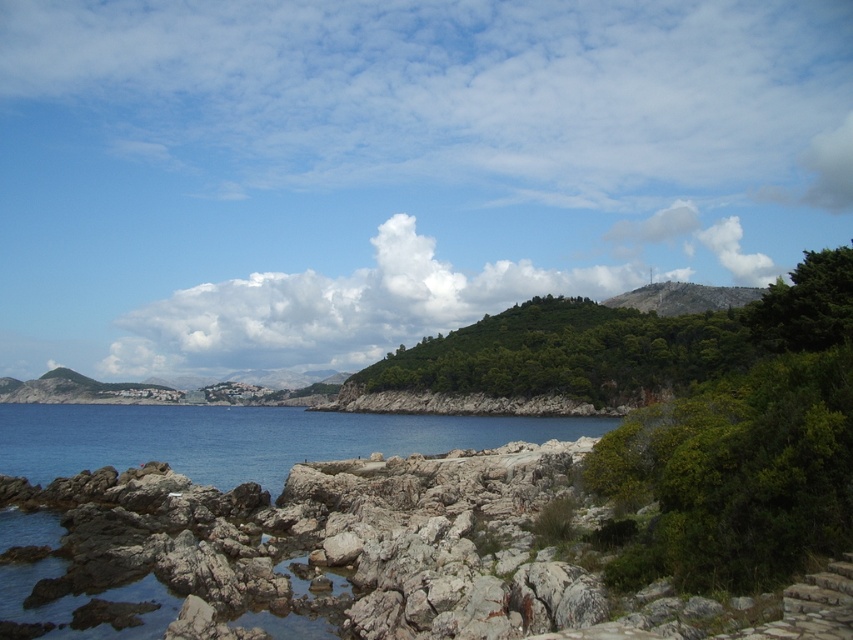
You are a hiker planning to cross the green leafy hill at center and the blue water at lower left. Which terrain would be easier to traverse?

The blue water at lower left is easier to traverse because it has a larger size than the green leafy hill at center.

Based on the coordinates provided, what is the position of the white fluffy cloud at upper center in the image?

The white fluffy cloud at upper center is located at the 2D coordinates point (334, 308).

You are a hiker standing at the base of the green leafy hill at center and want to reach the blue water at lower left. Which direction should you head towards?

The green leafy hill at center is to the right of the blue water at lower left, so you should head towards the left to reach the blue water at lower left.